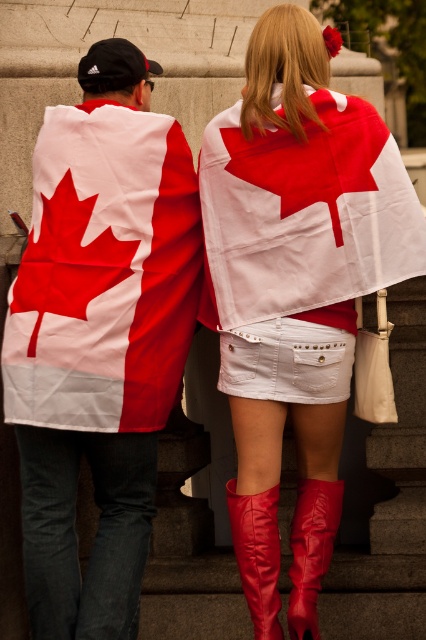
Does matte fabric flag at center appear over white denim skirt at center?

Correct, matte fabric flag at center is located above white denim skirt at center.

In the scene shown: Is matte fabric flag at center further to the viewer compared to white denim skirt at center?

No, it is not.

The height and width of the screenshot is (640, 426). What do you see at coordinates (100, 337) in the screenshot?
I see `matte fabric flag at center` at bounding box center [100, 337].

Where is `matte fabric flag at center`? The image size is (426, 640). matte fabric flag at center is located at coordinates (100, 337).

Is matte fabric flag at center closer to camera compared to shiny leather boot at lower center?

No.

Which of these two, matte fabric flag at center or shiny leather boot at lower center, stands shorter?

With less height is shiny leather boot at lower center.

What are the coordinates of `matte fabric flag at center` in the screenshot? It's located at (100, 337).

Find the location of a particular element. The image size is (426, 640). matte fabric flag at center is located at coordinates (100, 337).

Which is in front, point (261, 317) or point (264, 497)?

Point (264, 497) is more forward.

Between white fabric flag at center and red leather boot at lower center, which one is positioned lower?

red leather boot at lower center

Is point (359, 288) behind point (245, 502)?

No, (359, 288) is closer to viewer.

Locate an element on the screen. white fabric flag at center is located at coordinates (x=305, y=216).